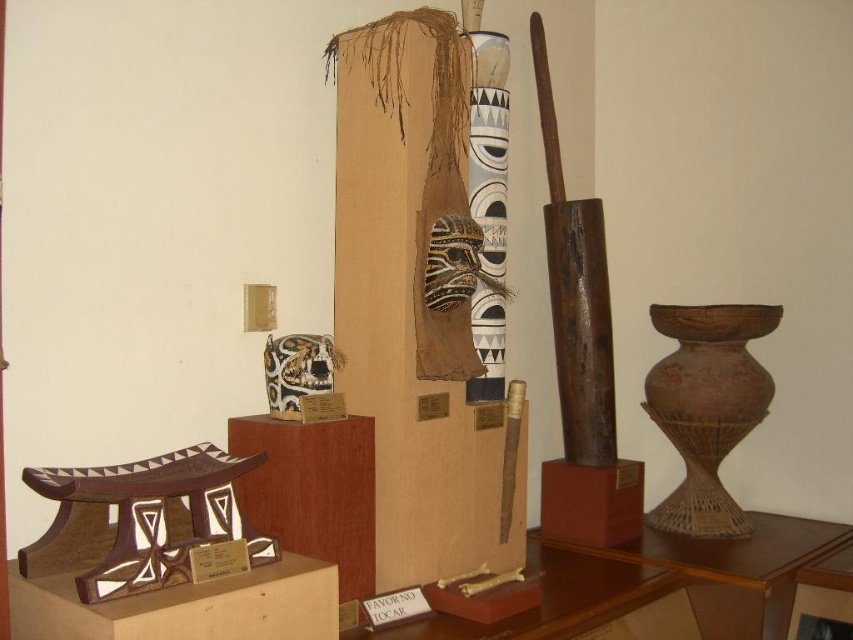
You are standing in front of the museum exhibit and want to take a photo of the wooden totem pole at center. Your camera has a minimum focus distance of 2 meters. Can you take a clear photo without moving closer?

The wooden totem pole at center is 2.37 meters away from camera, which is beyond the minimum focus distance of 2 meters. Therefore, you can take a clear photo without moving closer.

You are a museum visitor standing in front of the exhibit. The brown woven vase at right is displayed at a specific location. Can you determine if it is positioned closer to the top or bottom of the exhibit area?

The brown woven vase at right is positioned closer to the bottom of the exhibit area since its coordinates are at point (706, 406), where the y coordinate 0.829 indicates proximity to the bottom.